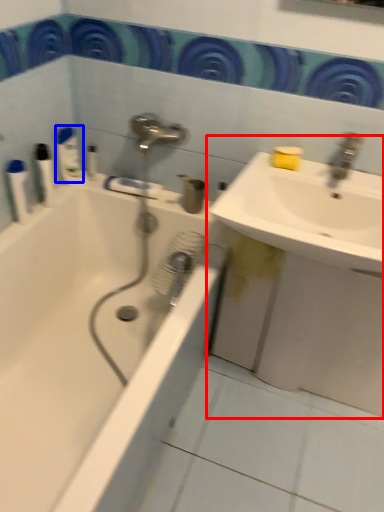
Question: Which object is closer to the camera taking this photo, sink (highlighted by a red box) or toiletry (highlighted by a blue box)?

Choices:
 (A) sink
 (B) toiletry

Answer: (A)